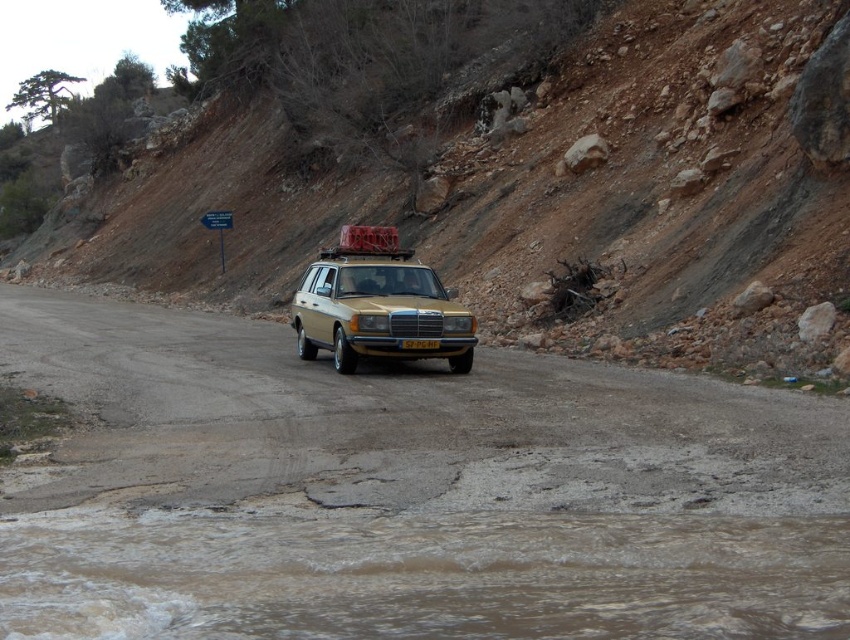
Question: Which of the following is the farthest from the observer?

Choices:
 (A) dull brown dirt at center
 (B) gold metallic car at center
 (C) yellow plastic license plate at center

Answer: (B)

Question: Does gold metallic car at center have a larger size compared to yellow plastic license plate at center?

Choices:
 (A) no
 (B) yes

Answer: (A)

Question: Does gold metallic car at center have a lesser width compared to yellow plastic license plate at center?

Choices:
 (A) yes
 (B) no

Answer: (A)

Question: Estimate the real-world distances between objects in this image. Which object is closer to the dull brown dirt at center?

Choices:
 (A) yellow plastic license plate at center
 (B) gold metallic car at center

Answer: (A)

Question: Does dull brown dirt at center appear under gold metallic car at center?

Choices:
 (A) yes
 (B) no

Answer: (B)

Question: Which point is farther to the camera?

Choices:
 (A) (341, 282)
 (B) (426, 339)
 (C) (694, 68)

Answer: (C)